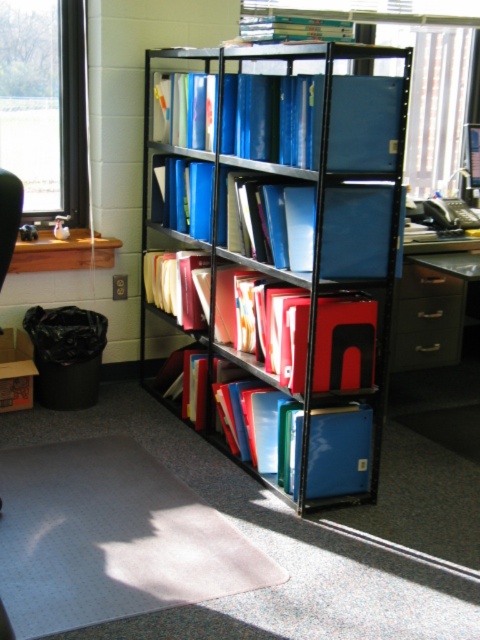
Question: Is metallic silver drawer at lower right wider than matte black drawer at center?

Choices:
 (A) no
 (B) yes

Answer: (B)

Question: Is clear glass window at upper left wider than black plastic drawer at right?

Choices:
 (A) yes
 (B) no

Answer: (A)

Question: Which point is farther from the camera taking this photo?

Choices:
 (A) (222, 54)
 (B) (394, 324)

Answer: (B)

Question: Which object is closer to the camera taking this photo?

Choices:
 (A) clear glass window at upper left
 (B) metallic silver drawer at lower right
 (C) matte black drawer at center

Answer: (C)

Question: Can you confirm if black plastic drawer at right is positioned below matte yellow folder at center?

Choices:
 (A) no
 (B) yes

Answer: (B)

Question: Among these objects, which one is farthest from the camera?

Choices:
 (A) black plastic drawer at right
 (B) blue plastic folders at center
 (C) transparent plastic window at upper center

Answer: (C)